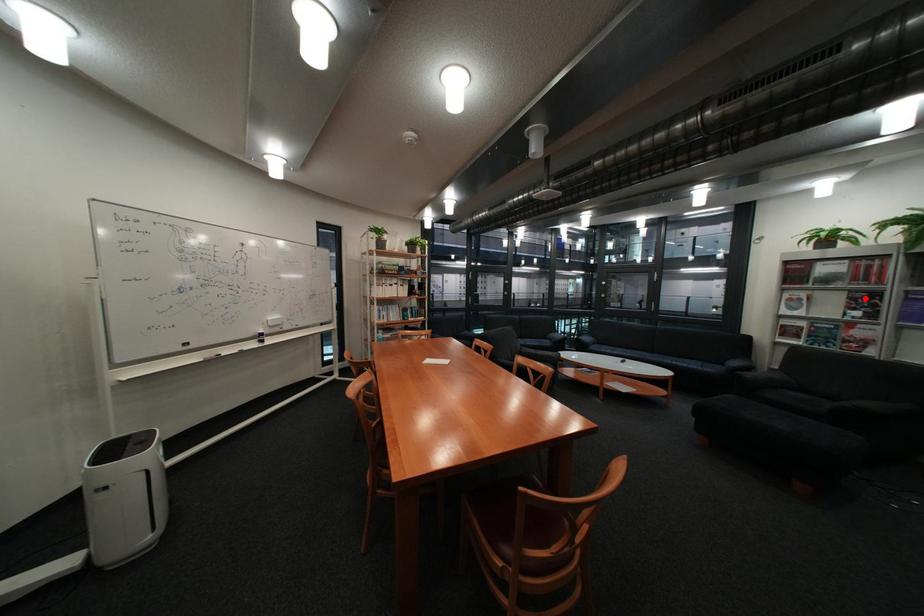
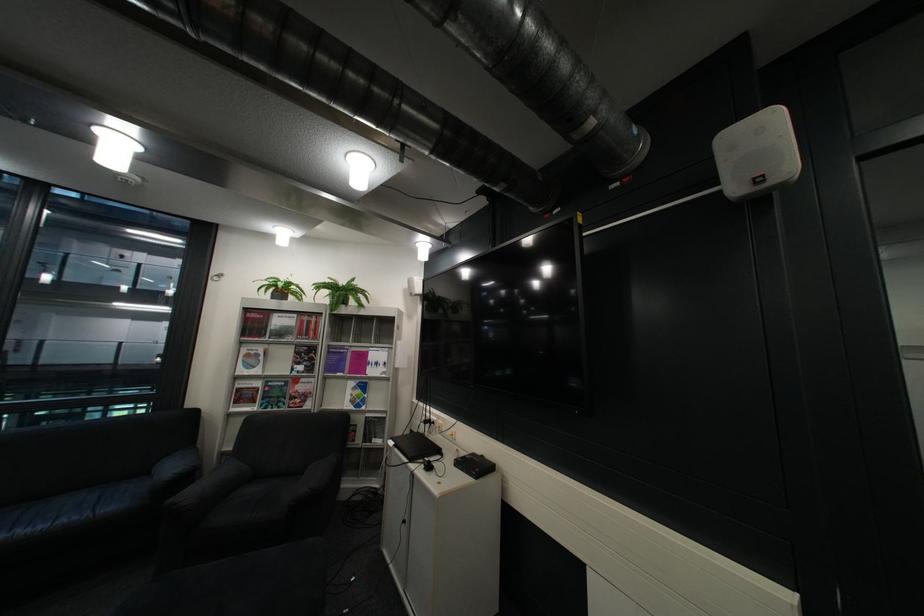
Locate, in the second image, the point that corresponds to the highlighted location in the first image.

(311, 353)